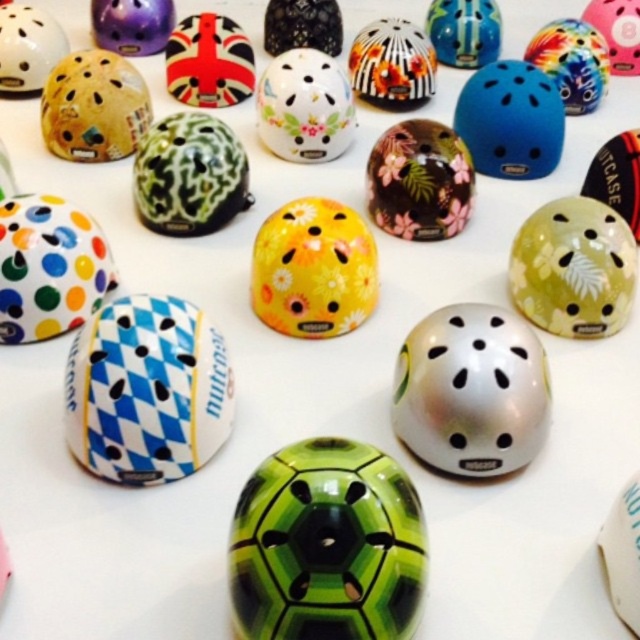
Does blue and white checkered helmet at center-left have a lesser width compared to matte white helmet at upper left?

No, blue and white checkered helmet at center-left is not thinner than matte white helmet at upper left.

Image resolution: width=640 pixels, height=640 pixels. Identify the location of blue and white checkered helmet at center-left. (147, 390).

What do you see at coordinates (147, 390) in the screenshot? I see `blue and white checkered helmet at center-left` at bounding box center [147, 390].

This screenshot has width=640, height=640. In order to click on blue and white checkered helmet at center-left in this screenshot , I will do `click(147, 390)`.

Does union jack helmet at center come behind glossy blue helmet at upper center?

That is False.

Who is positioned more to the right, union jack helmet at center or glossy blue helmet at upper center?

glossy blue helmet at upper center is more to the right.

Between point (214, 58) and point (464, 67), which one is positioned behind?

The point (464, 67) is behind.

Locate an element on the screen. union jack helmet at center is located at coordinates (209, 61).

Can you confirm if green glossy helmet at center is positioned below blue glossy helmet at upper center?

Yes.

Is point (260, 588) positioned before point (515, 109)?

Yes, it is in front of point (515, 109).

Where is `green glossy helmet at center`? This screenshot has height=640, width=640. green glossy helmet at center is located at coordinates (326, 545).

Locate an element on the screen. This screenshot has height=640, width=640. green glossy helmet at center is located at coordinates (326, 545).